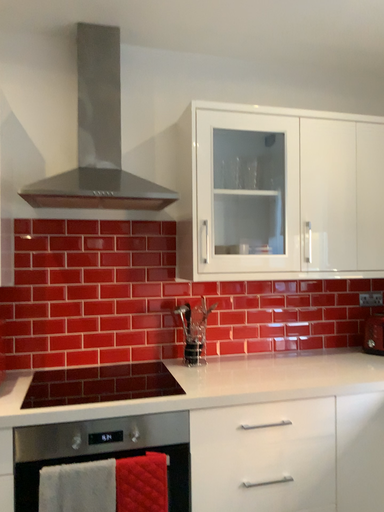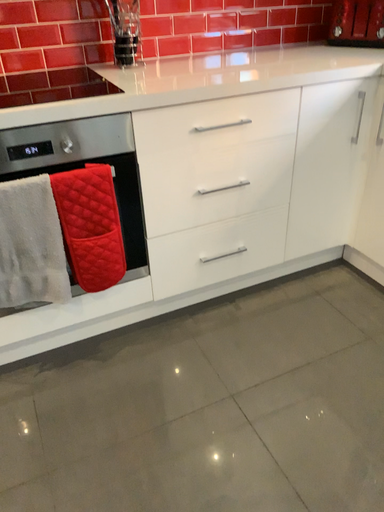
Question: Which way did the camera rotate in the video?

Choices:
 (A) rotated downward
 (B) rotated upward

Answer: (A)